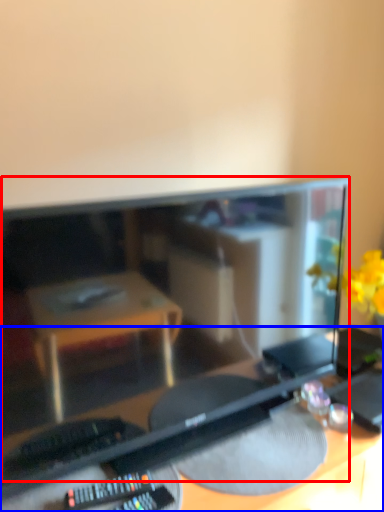
Question: Which point is closer to the camera, computer monitor (highlighted by a red box) or desk (highlighted by a blue box)?

Choices:
 (A) computer monitor
 (B) desk

Answer: (B)